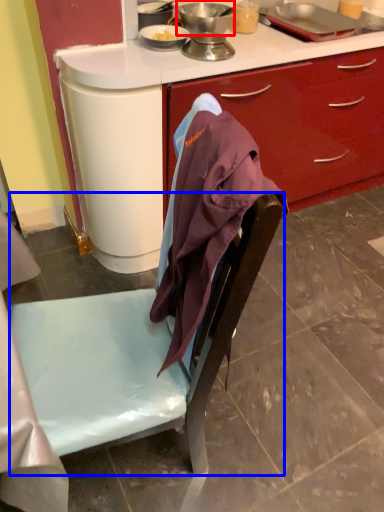
Question: Which object appears farthest to the camera in this image, kitchen appliance (highlighted by a red box) or chair (highlighted by a blue box)?

Choices:
 (A) kitchen appliance
 (B) chair

Answer: (A)